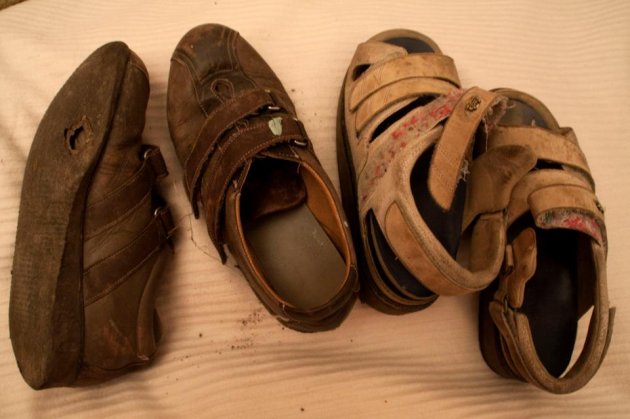
The image size is (630, 419). I want to click on bed, so click(x=237, y=366).